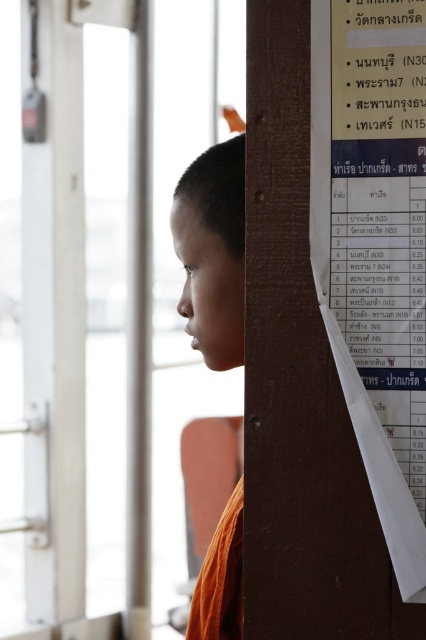
Does white paper at right appear over orange cloth at lower right?

Yes, white paper at right is above orange cloth at lower right.

Is point (377, 13) positioned behind point (238, 522)?

No, (377, 13) is closer to viewer.

At what (x,y) coordinates should I click in order to perform the action: click on white paper at right. Please return your answer as a coordinate pair (x, y). The width and height of the screenshot is (426, 640). Looking at the image, I should click on (374, 248).